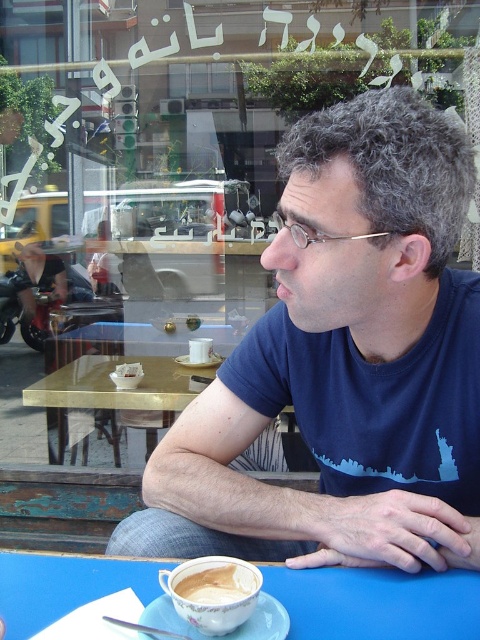
Can you confirm if blue cotton shirt at center is thinner than white ceramic saucer at center?

Incorrect, blue cotton shirt at center's width is not less than white ceramic saucer at center's.

Locate an element on the screen. blue cotton shirt at center is located at coordinates (344, 362).

Is point (197, 496) positioned after point (412, 595)?

Yes.

Where is `blue cotton shirt at center`? This screenshot has width=480, height=640. blue cotton shirt at center is located at coordinates coord(344,362).

Is point (301, 132) in front of point (163, 609)?

No, it is behind (163, 609).

Is blue cotton shirt at center to the left of porcelain saucer at lower center from the viewer's perspective?

In fact, blue cotton shirt at center is to the right of porcelain saucer at lower center.

Is point (285, 278) closer to camera compared to point (252, 632)?

No.

Where is `blue cotton shirt at center`? The image size is (480, 640). blue cotton shirt at center is located at coordinates (344, 362).